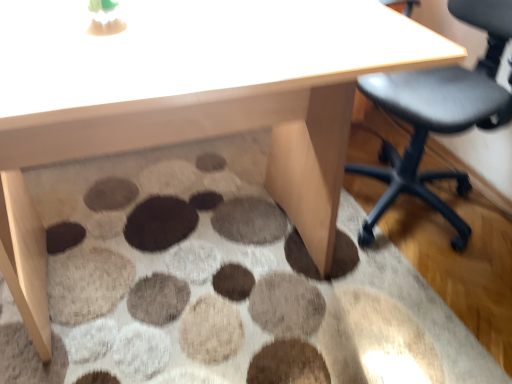
Locate an element on the screen. The height and width of the screenshot is (384, 512). black leather chair at right is located at coordinates (438, 114).

Describe the element at coordinates (438, 114) in the screenshot. I see `black leather chair at right` at that location.

You are a GUI agent. You are given a task and a screenshot of the screen. Output one action in this format:
    pyautogui.click(x=<x>, y=<y>)
    Task: Click on the black leather chair at right
    The height and width of the screenshot is (384, 512).
    Given the screenshot: What is the action you would take?
    pyautogui.click(x=438, y=114)